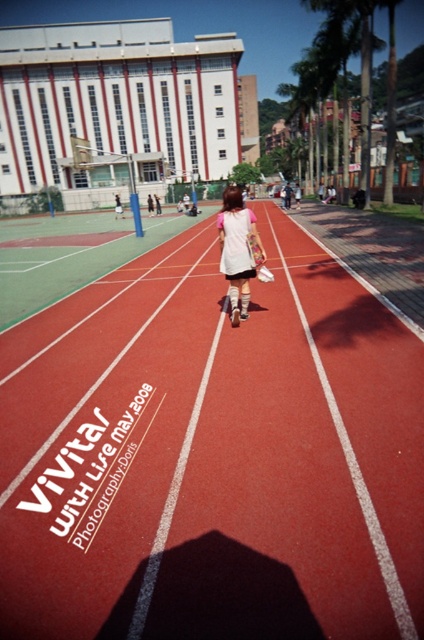
The image size is (424, 640). I want to click on matte pink shirt at center, so click(237, 250).

Between point (226, 234) and point (253, 262), which one is positioned behind?

Point (253, 262)

Is point (248, 228) behind point (262, 275)?

No, it is in front of (262, 275).

Locate an element on the screen. The image size is (424, 640). matte pink shirt at center is located at coordinates 237,250.

Is white rubber finish line at center shorter than white plastic tennis racket at center?

Yes.

Can you confirm if white rubber finish line at center is positioned below white plastic tennis racket at center?

Correct, white rubber finish line at center is located below white plastic tennis racket at center.

Is point (61, 492) behind point (261, 259)?

No, (61, 492) is in front of (261, 259).

The height and width of the screenshot is (640, 424). I want to click on white rubber finish line at center, so click(92, 468).

Looking at this image, between rubber running track at center and matte pink shirt at center, which one has less height?

matte pink shirt at center

Which is below, rubber running track at center or matte pink shirt at center?

rubber running track at center is lower down.

The width and height of the screenshot is (424, 640). I want to click on rubber running track at center, so click(212, 456).

Find the location of `rubber running track at center`. rubber running track at center is located at coordinates (212, 456).